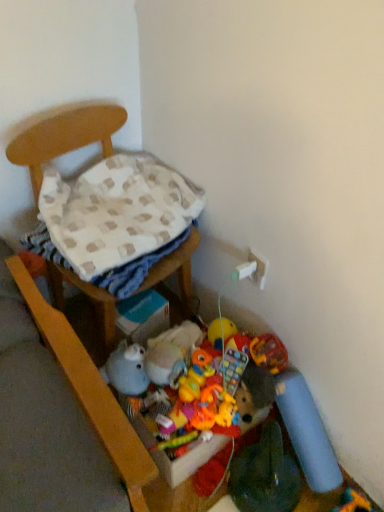
Question: Is soft plush toy at lower right, positioned as the 1th toy in right-to-left order, bigger or smaller than rubberized plastic toy at center, which ranks as the second toy in right-to-left order?

Choices:
 (A) small
 (B) big

Answer: (B)

Question: From the image's perspective, is soft plush toy at lower right, the 4th toy positioned from the top, above or below rubberized plastic toy at center, which appears as the 3th toy when viewed from the left?

Choices:
 (A) below
 (B) above

Answer: (A)

Question: Which of these objects is positioned closest to the rubberized plastic toy at center, marked as the second toy in a bottom-to-top arrangement?

Choices:
 (A) wooden chair at left
 (B) fuzzy fabric stuffed animal at lower center, positioned as the second toy in top-to-bottom order
 (C) soft plush toy at lower right, which is the 1th toy from bottom to top
 (D) soft plush duck at lower center, the 1th toy from the top
 (E) beige checkered blanket at left

Answer: (D)

Question: Which of these objects is positioned closest to the rubberized plastic toy at center, which ranks as the second toy in right-to-left order?

Choices:
 (A) beige checkered blanket at left
 (B) wooden chair at left
 (C) soft plush toy at lower right, which is the 1th toy from bottom to top
 (D) fuzzy fabric stuffed animal at lower center, the first toy viewed from the left
 (E) soft plush duck at lower center, acting as the 2th toy starting from the left

Answer: (E)